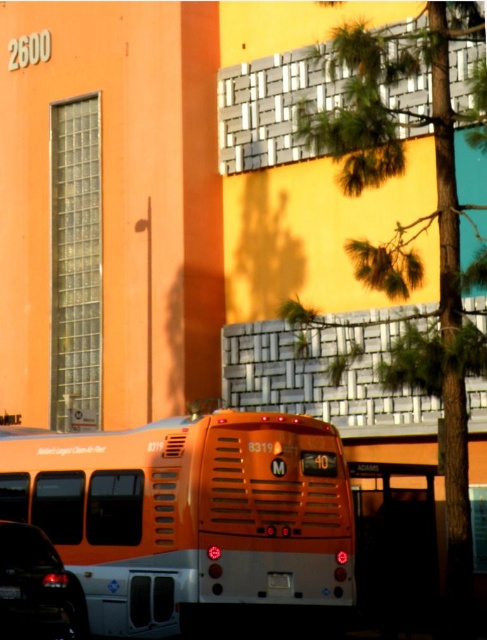
You are a pedestrian standing on the sidewalk in front of the building. You see the orange matte bus at center and the shiny black sedan at lower left. Which vehicle is closer to you?

The orange matte bus at center is closer to you because it is further to the viewer than the shiny black sedan at lower left.

You are a delivery person who needs to park your delivery van, which is 2.5 meters wide, in this area. The parking spot is between the orange matte bus at center and the shiny black sedan at lower left. Can your van fit in this space?

The orange matte bus at center might be wider than shiny black sedan at lower left, so the space between them may not be wide enough for a 2.5 meter wide van. You should check the exact width before attempting to park.